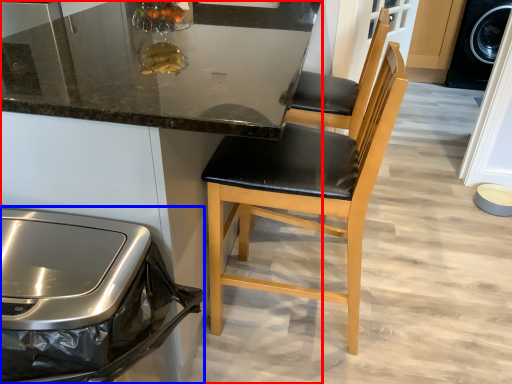
Question: Which point is further to the camera, cabinetry (highlighted by a red box) or home appliance (highlighted by a blue box)?

Choices:
 (A) cabinetry
 (B) home appliance

Answer: (A)